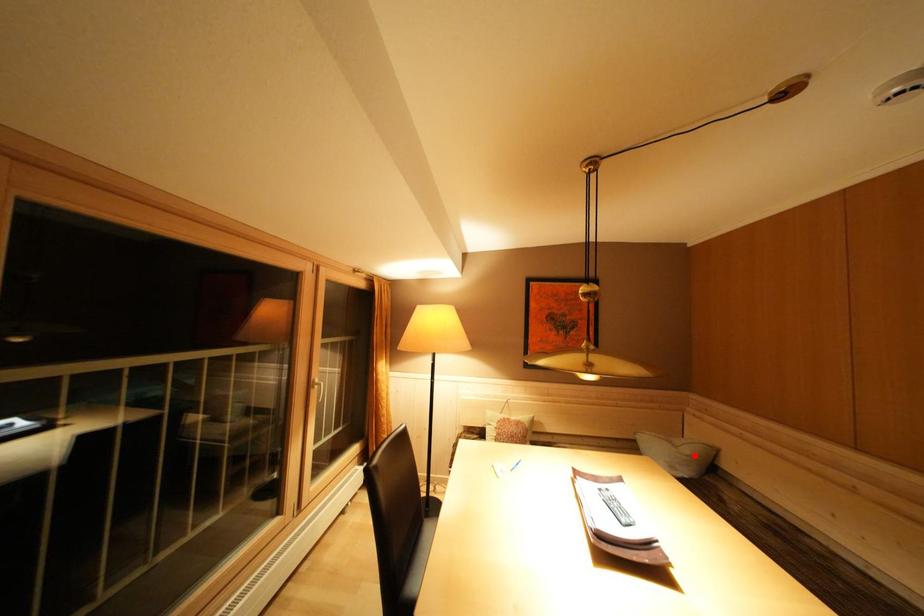
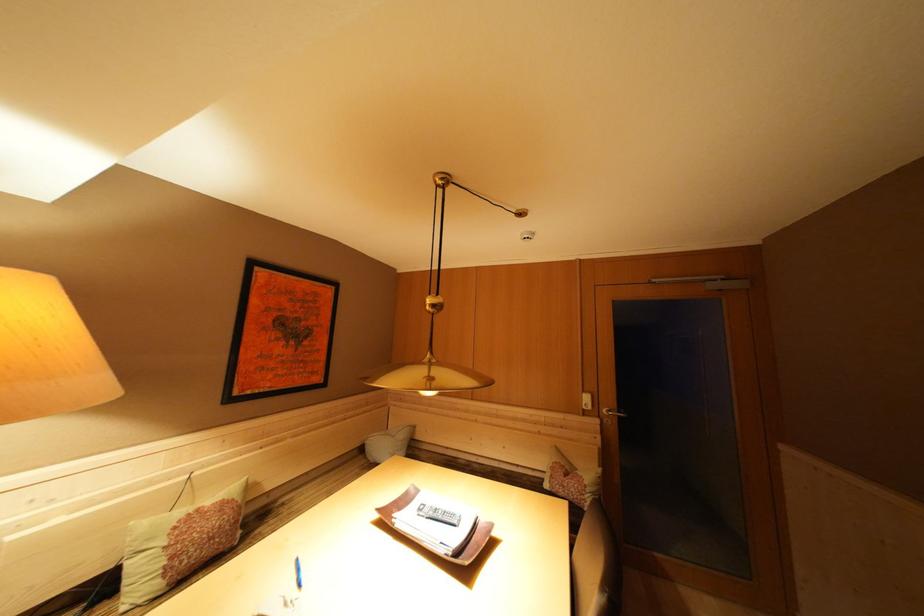
The point at the highlighted location is marked in the first image. Where is the corresponding point in the second image?

(408, 440)